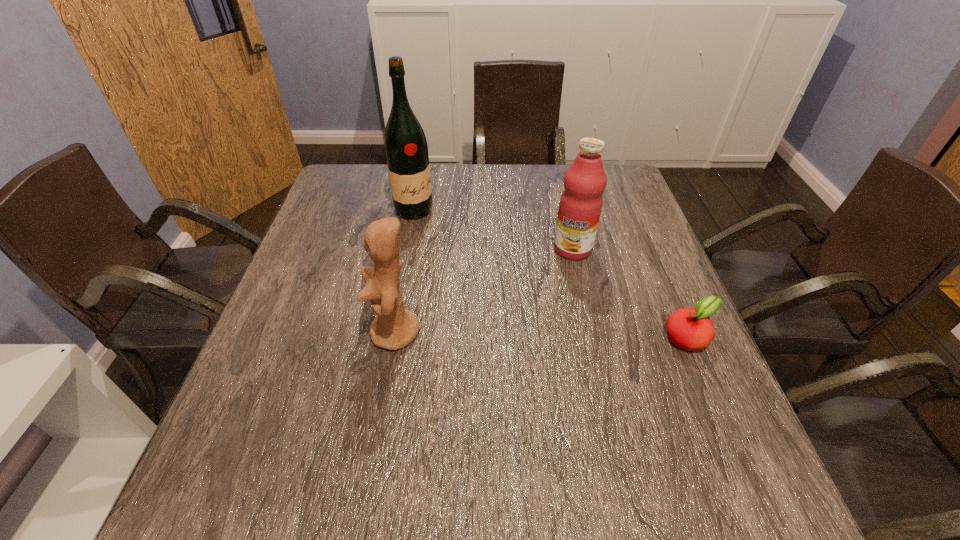
Locate an element on the screen. The height and width of the screenshot is (540, 960). free space between the farthest object and the figurine is located at coordinates (404, 272).

This screenshot has height=540, width=960. I want to click on free space between the shortest object and the figurine, so (x=541, y=335).

Find the location of a particular element. Image resolution: width=960 pixels, height=540 pixels. free area in between the farthest object and the figurine is located at coordinates (404, 272).

Locate an element on the screen. empty space that is in between the liquor and the rightmost object is located at coordinates (551, 274).

Find the location of `object that is the closest one to the apple`. object that is the closest one to the apple is located at coordinates (580, 206).

Where is `object that is the closest one to the figurine`? object that is the closest one to the figurine is located at coordinates (406, 149).

You are a GUI agent. You are given a task and a screenshot of the screen. Output one action in this format:
    pyautogui.click(x=<x>, y=<y>)
    Task: Click on the vacant space that satisfies the following two spatial constraints: 1. on the front side of the figurine; 2. on the front-facing side of the liquor
    
    Given the screenshot: What is the action you would take?
    pyautogui.click(x=391, y=333)

Locate an element on the screen. This screenshot has height=540, width=960. vacant space that satisfies the following two spatial constraints: 1. on the front side of the rightmost object; 2. on the right side of the third object from left to right is located at coordinates (593, 338).